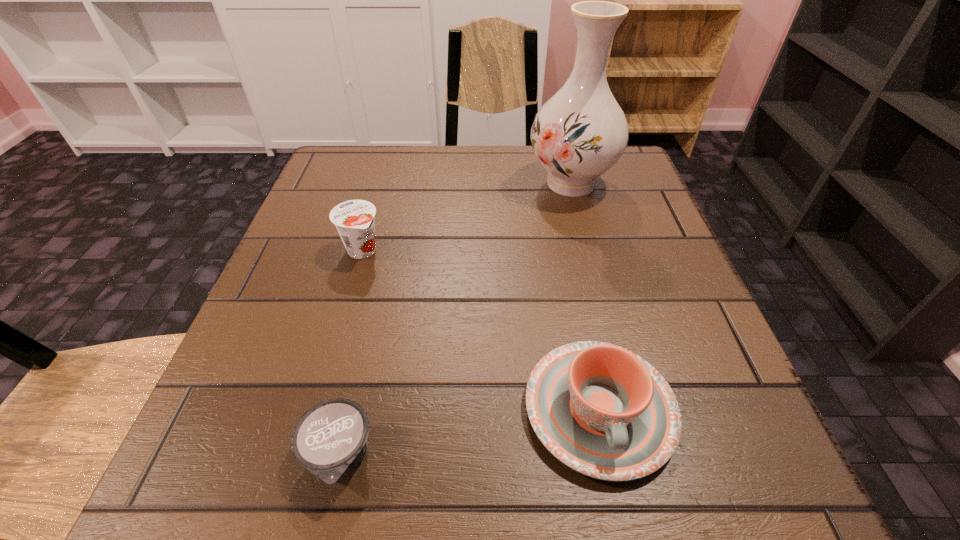
The height and width of the screenshot is (540, 960). Identify the location of vase. (581, 132).

You are a GUI agent. You are given a task and a screenshot of the screen. Output one action in this format:
    pyautogui.click(x=<x>, y=<y>)
    Task: Click on the farthest object
    Image resolution: width=960 pixels, height=540 pixels.
    Given the screenshot: What is the action you would take?
    pyautogui.click(x=581, y=132)

Identify the location of the farther yogurt. This screenshot has height=540, width=960. (354, 219).

Identify the location of the taller yogurt. (354, 219).

Where is `chinaware`? chinaware is located at coordinates (603, 411).

The image size is (960, 540). In order to click on the nearer yogurt in this screenshot , I will do `click(330, 439)`.

The width and height of the screenshot is (960, 540). Find the location of `the shorter yogurt`. the shorter yogurt is located at coordinates (330, 439).

You are a GUI agent. You are given a task and a screenshot of the screen. Output one action in this format:
    pyautogui.click(x=<x>, y=<y>)
    Task: Click on the vacant space located on the front of the farthest object
    Image resolution: width=960 pixels, height=540 pixels.
    Given the screenshot: What is the action you would take?
    pyautogui.click(x=598, y=288)

Where is `blank space located on the right of the taller yogurt`? This screenshot has width=960, height=540. blank space located on the right of the taller yogurt is located at coordinates (567, 251).

Where is `free location located on the back of the nearer yogurt`? free location located on the back of the nearer yogurt is located at coordinates (386, 251).